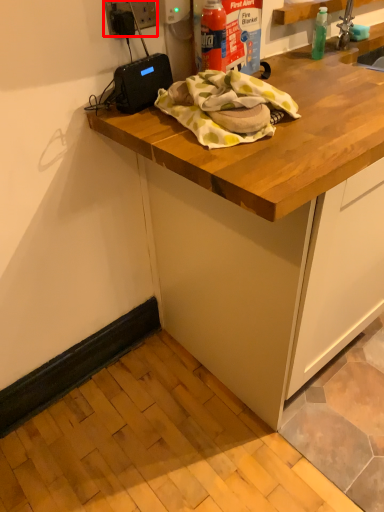
Question: From the image, what is the correct spatial relationship of electric outlet (annotated by the red box) in relation to cabinetry?

Choices:
 (A) right
 (B) left

Answer: (B)